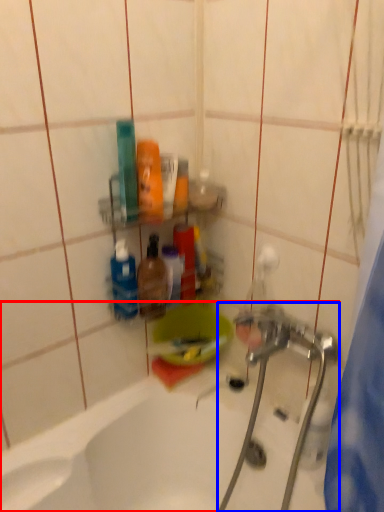
Question: Which of the following is the farthest to the observer, bathtub (highlighted by a red box) or plumbing fixture (highlighted by a blue box)?

Choices:
 (A) bathtub
 (B) plumbing fixture

Answer: (B)